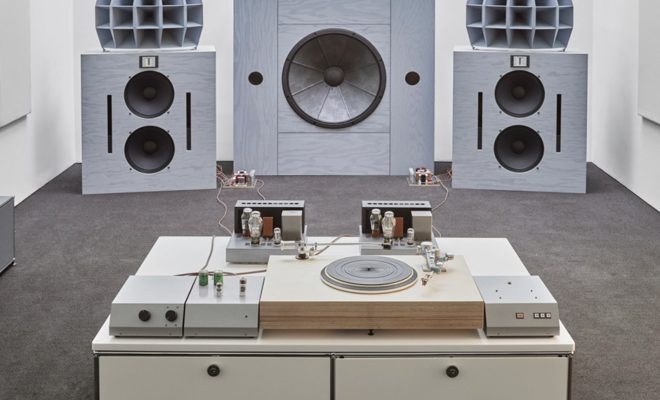
Image resolution: width=660 pixels, height=400 pixels. In order to click on knob in this screenshot , I will do coord(451,373), coord(210,368).